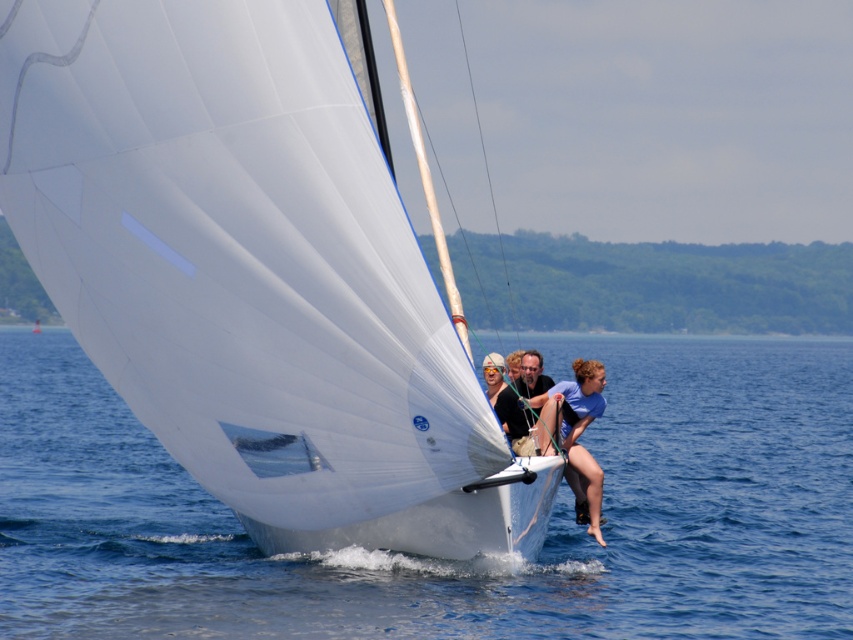
Who is higher up, blue water at sailboat right or matte black shorts at center?

Positioned higher is blue water at sailboat right.

Which of these two, blue water at sailboat right or matte black shorts at center, stands shorter?

With less height is matte black shorts at center.

The image size is (853, 640). Describe the element at coordinates (450, 561) in the screenshot. I see `blue water at sailboat right` at that location.

This screenshot has height=640, width=853. I want to click on blue water at sailboat right, so click(x=450, y=561).

Can you confirm if white matte sailboat at center is positioned to the left of matte black shorts at center?

Indeed, white matte sailboat at center is positioned on the left side of matte black shorts at center.

Is point (32, 248) farther from camera compared to point (538, 449)?

No, it is not.

Locate an element on the screen. Image resolution: width=853 pixels, height=640 pixels. white matte sailboat at center is located at coordinates (253, 272).

Is white matte sailboat at center further to camera compared to blue water at sailboat right?

No, it is in front of blue water at sailboat right.

Does point (265, 396) lie behind point (485, 634)?

No, it is not.

Does point (392, 355) come closer to viewer compared to point (647, 490)?

Yes.

Locate an element on the screen. white matte sailboat at center is located at coordinates (253, 272).